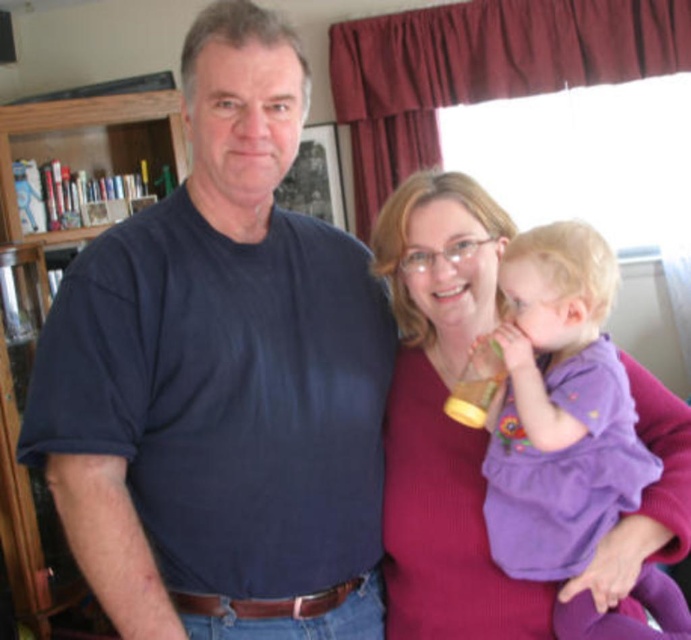
Question: Where is dark blue t-shirt at left located in relation to wooden bookshelf at left in the image?

Choices:
 (A) above
 (B) below

Answer: (B)

Question: Which object is farther from the camera taking this photo?

Choices:
 (A) dark blue t-shirt at left
 (B) wooden bookshelf at left
 (C) purple soft fabric baby at center

Answer: (B)

Question: Which object appears farthest from the camera in this image?

Choices:
 (A) dark blue t-shirt at left
 (B) purple soft fabric baby at center
 (C) wooden bookshelf at left

Answer: (C)

Question: In this image, where is purple soft fabric baby at center located relative to wooden bookshelf at left?

Choices:
 (A) above
 (B) below

Answer: (B)

Question: Is dark blue t-shirt at left to the left of wooden bookshelf at left from the viewer's perspective?

Choices:
 (A) yes
 (B) no

Answer: (B)

Question: Which point is closer to the camera?

Choices:
 (A) (556, 429)
 (B) (390, 337)

Answer: (A)